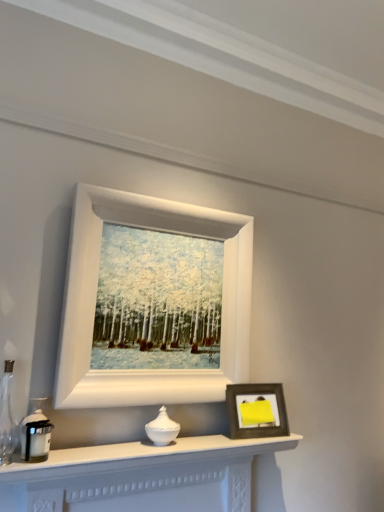
Identify the location of vacant space situated above white matte fireplace at lower center (from a real-world perspective). (171, 440).